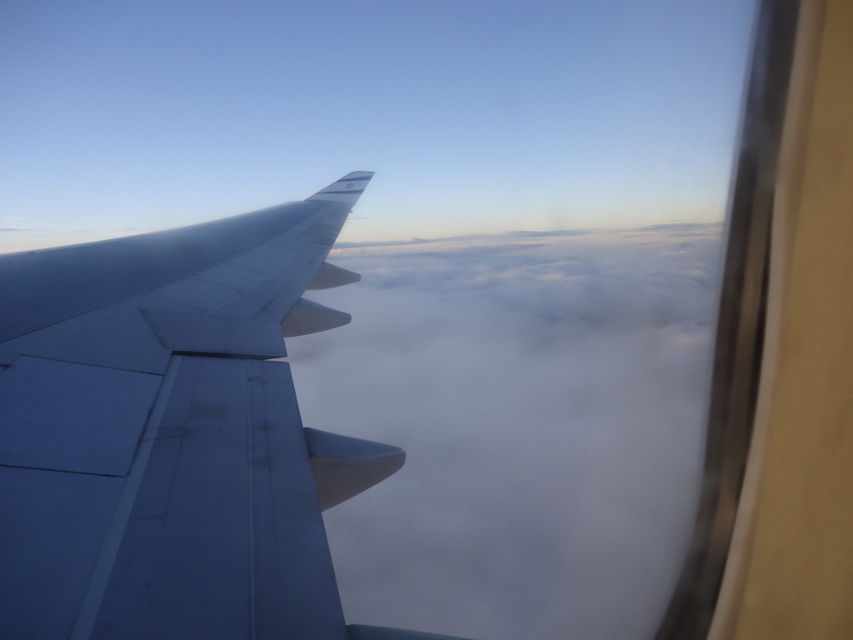
Looking at this image, who is lower down, white fluffy cloud at center or matte gray wing at left?

white fluffy cloud at center is lower down.

Can you confirm if white fluffy cloud at center is wider than matte gray wing at left?

Indeed, white fluffy cloud at center has a greater width compared to matte gray wing at left.

Where is `white fluffy cloud at center`? This screenshot has height=640, width=853. white fluffy cloud at center is located at coordinates (518, 426).